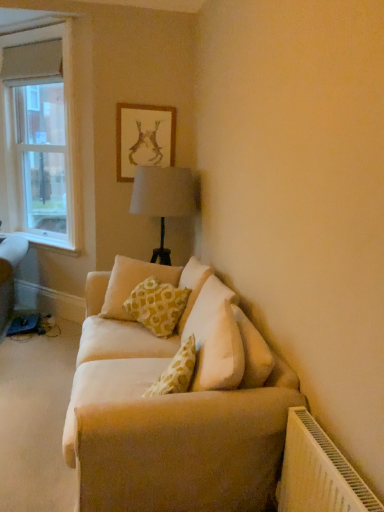
Question: Relative to beige fabric couch at center, is gold-framed artwork at upper center in front or behind?

Choices:
 (A) behind
 (B) front

Answer: (A)

Question: From a real-world perspective, is gold-framed artwork at upper center above or below beige fabric couch at center?

Choices:
 (A) below
 (B) above

Answer: (B)

Question: Which is nearer to the white wood at left?

Choices:
 (A) yellow printed cushion at center
 (B) gold-framed artwork at upper center
 (C) clear glass window at left
 (D) beige fabric couch at center

Answer: (C)

Question: Based on their relative distances, which object is farther from the clear glass window at left?

Choices:
 (A) gold-framed artwork at upper center
 (B) beige fabric couch at center
 (C) yellow printed cushion at center
 (D) white wood at left

Answer: (B)